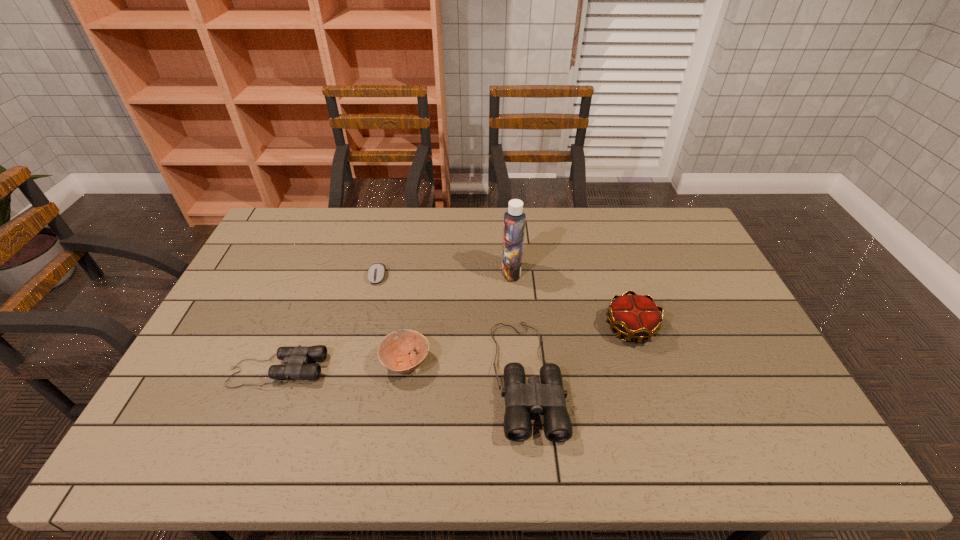
I want to click on vacant area at the left edge of the desktop, so click(280, 289).

What are the coordinates of `vacant space at the right edge of the desktop` in the screenshot? It's located at (674, 264).

I want to click on free location at the far right corner, so click(662, 224).

At what (x,y) coordinates should I click in order to perform the action: click on vacant space that is in between the third shortest object and the right binoculars. Please return your answer as a coordinate pair (x, y). This screenshot has height=540, width=960. Looking at the image, I should click on (467, 369).

What are the coordinates of `free area in between the shampoo and the right binoculars` in the screenshot? It's located at (519, 324).

The image size is (960, 540). Identify the location of vacant point located between the taller binoculars and the rightmost object. (579, 352).

The width and height of the screenshot is (960, 540). Identify the location of free space between the rightmost object and the shampoo. (571, 300).

Locate an element on the screen. This screenshot has height=540, width=960. free space between the fourth tallest object and the rightmost object is located at coordinates (518, 345).

Find the location of a particular element. vacant space that's between the bowl and the leftmost object is located at coordinates (342, 366).

This screenshot has width=960, height=540. Identify the location of free area in between the tallest object and the computer equipment. (x=444, y=274).